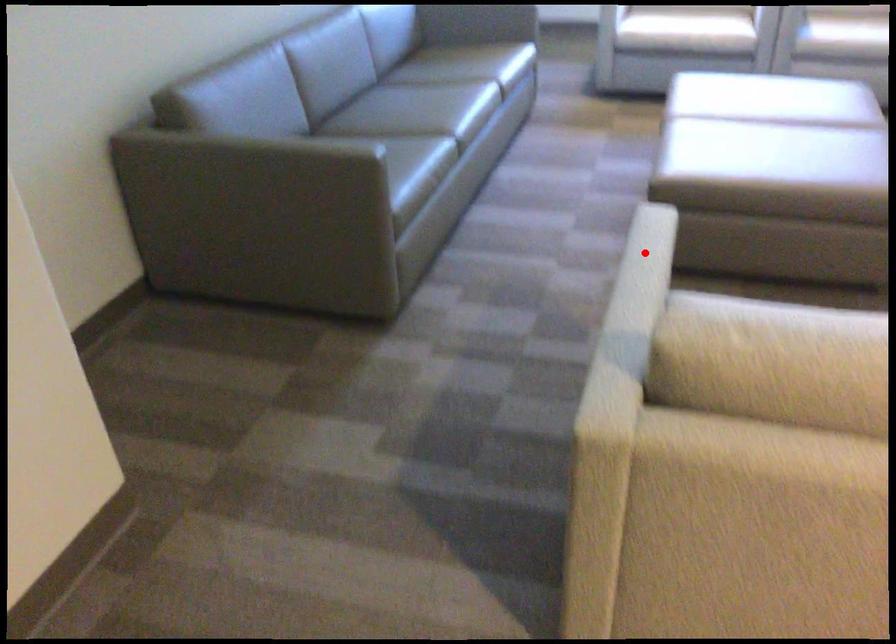
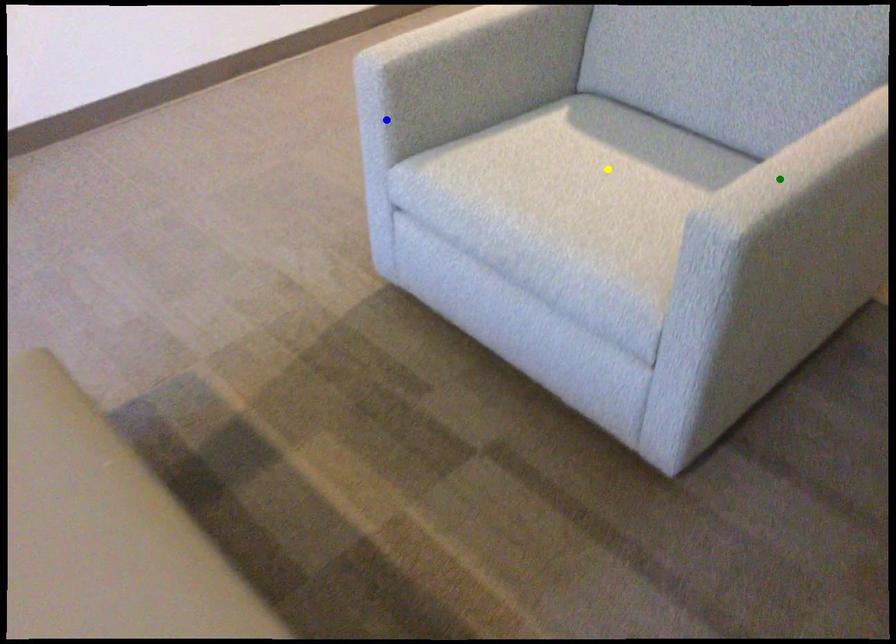
Question: I am providing you with two images of the same scene from different viewpoints. A red point is marked on the first image. You are given multiple points on the second image. Can you choose the point in image 2 that corresponds to the point in image 1?

Choices:
 (A) yellow point
 (B) green point
 (C) blue point

Answer: (B)